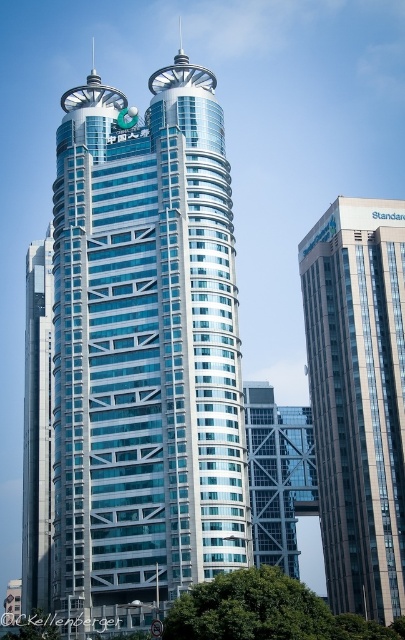
Question: Which is farther from the glassy steel skyscraper at left?

Choices:
 (A) glassy metallic skyscraper at center
 (B) matte glass building at right

Answer: (B)

Question: Can you confirm if glassy metallic skyscraper at center is thinner than glassy steel skyscraper at left?

Choices:
 (A) yes
 (B) no

Answer: (B)

Question: Is glassy metallic skyscraper at center below matte glass building at right?

Choices:
 (A) no
 (B) yes

Answer: (A)

Question: Which object is positioned closest to the glassy steel skyscraper at left?

Choices:
 (A) glassy metallic skyscraper at center
 (B) matte glass building at right

Answer: (A)

Question: Is glassy metallic skyscraper at center thinner than matte glass building at right?

Choices:
 (A) yes
 (B) no

Answer: (B)

Question: Which of the following is the farthest from the observer?

Choices:
 (A) matte glass building at right
 (B) glassy metallic skyscraper at center

Answer: (A)